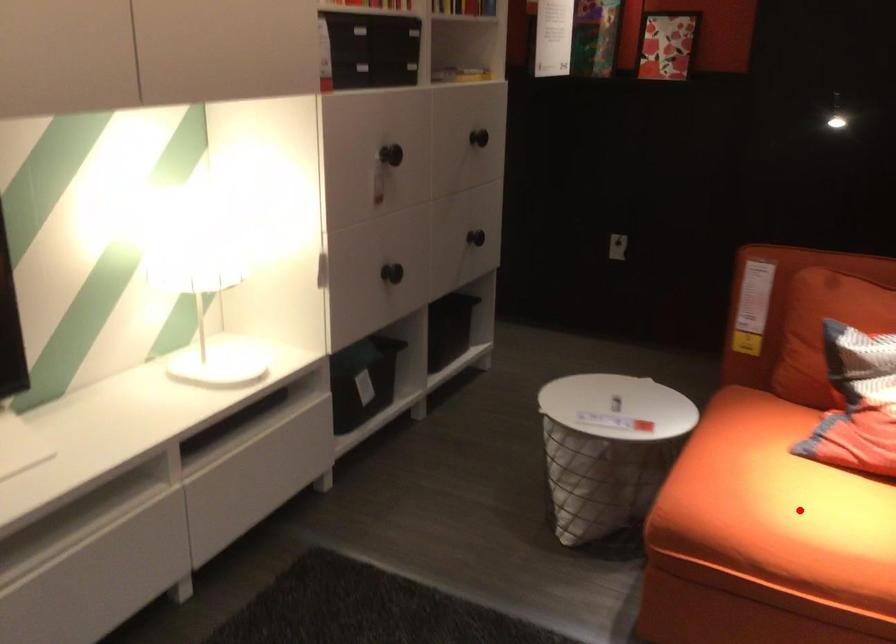
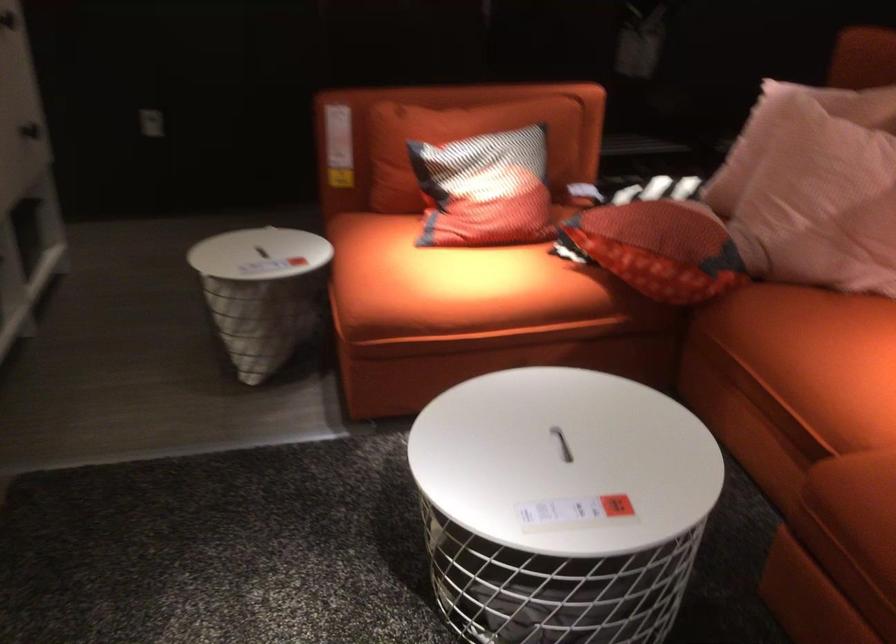
Question: I am providing you with two images of the same scene from different viewpoints. A red point is shown in image1. For the corresponding object point in image2, is it positioned nearer or farther from the camera?

Choices:
 (A) Nearer
 (B) Farther

Answer: (B)